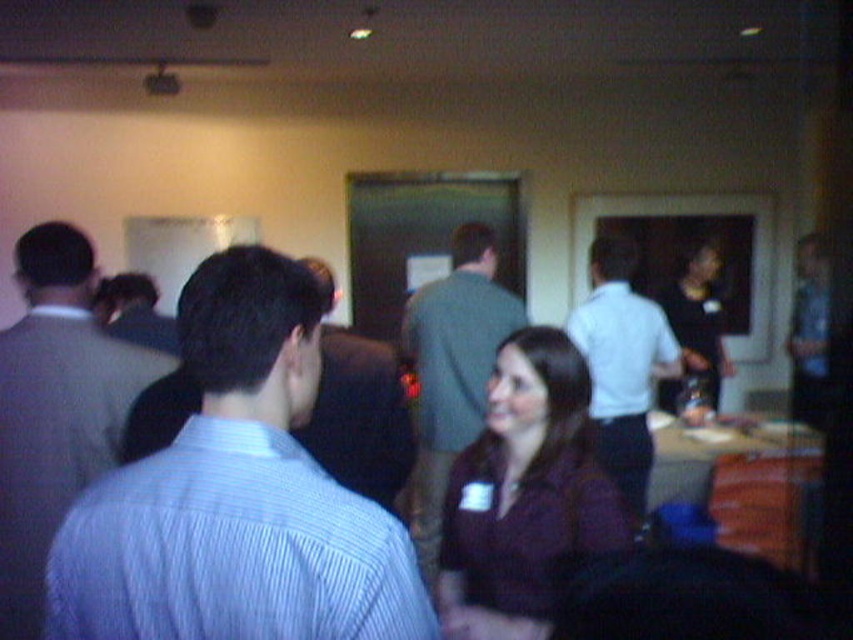
From the picture: Which of these two, blue striped shirt at center or gray striped shirt at center, stands shorter?

Standing shorter between the two is gray striped shirt at center.

The image size is (853, 640). What are the coordinates of `blue striped shirt at center` in the screenshot? It's located at (236, 496).

Between point (392, 586) and point (149, 310), which one is positioned in front?

Point (392, 586)

Find the location of a particular element. This screenshot has height=640, width=853. blue striped shirt at center is located at coordinates (236, 496).

Can you confirm if green fabric shirt at center is thinner than dark gray suit at center?

In fact, green fabric shirt at center might be wider than dark gray suit at center.

Who is more distant from viewer, (448, 323) or (328, 401)?

The point (448, 323) is behind.

In order to click on green fabric shirt at center in this screenshot , I will do `click(451, 371)`.

Where is `green fabric shirt at center`? green fabric shirt at center is located at coordinates pyautogui.click(x=451, y=371).

Does white shirt at center have a lesser height compared to matte black shirt at center?

Incorrect, white shirt at center's height does not fall short of matte black shirt at center's.

Does white shirt at center lie behind matte black shirt at center?

No, white shirt at center is closer to the viewer.

Is point (607, 365) in front of point (675, 387)?

Yes, it is.

Identify the location of white shirt at center. (622, 365).